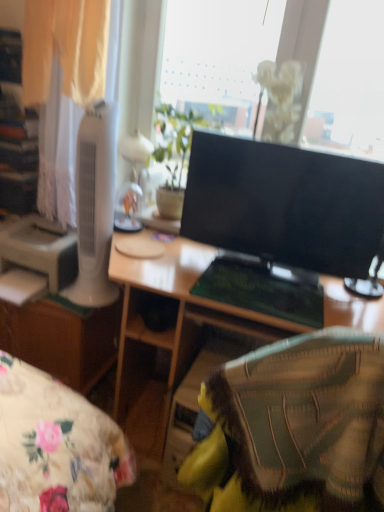
Question: Looking at the image, does black glossy monitor at center seem bigger or smaller compared to white plastic tower fan at left?

Choices:
 (A) small
 (B) big

Answer: (B)

Question: Is black glossy monitor at center situated inside white plastic tower fan at left or outside?

Choices:
 (A) outside
 (B) inside

Answer: (A)

Question: Estimate the real-world distances between objects in this image. Which object is farther from the matte white table lamp at upper center?

Choices:
 (A) white plastic printer at left
 (B) white sheer curtain at left
 (C) black glossy monitor at center
 (D) white plastic tower fan at left
 (E) green leafy plant at upper center

Answer: (C)

Question: Which object is positioned farthest from the white sheer curtain at left?

Choices:
 (A) black glossy monitor at center
 (B) white plastic printer at left
 (C) green leafy plant at upper center
 (D) matte white table lamp at upper center
 (E) wooden desk at center

Answer: (A)